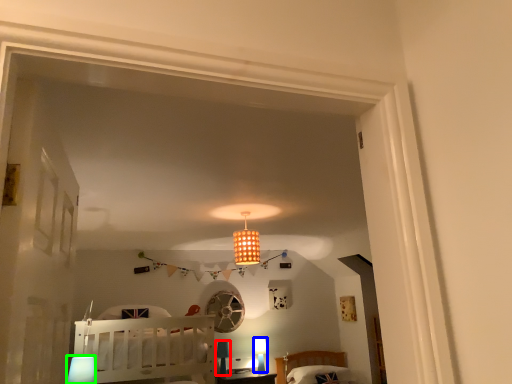
Question: Based on their relative distances, which object is farther from lamp (highlighted by a red box)? Choose from lamp (highlighted by a blue box) and lamp (highlighted by a green box).

Choices:
 (A) lamp
 (B) lamp

Answer: (B)